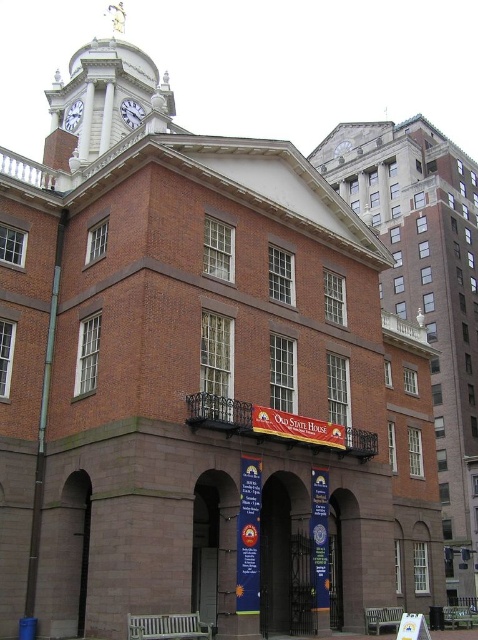
You are a tourist standing in front of the Old State House and want to take a photo that includes both the white marble clock tower at upper left and the silver metallic clock at upper center. Based on their positions, which one should you position to the left side in your camera viewfinder?

The white marble clock tower at upper left is positioned on the left side of the silver metallic clock at upper center, so you should place the white marble clock tower at upper left to the left side in your camera viewfinder.

You are standing in front of the Old State House and notice two clocks on the central clock tower. The first is a white glossy clock at upper center and the second is a silver metallic clock at upper center. From your vantage point, which clock appears closer to you?

The white glossy clock at upper center appears closer because it is in front of the silver metallic clock at upper center.

You are standing in front of the Old State House and notice the white metallic clock at upper center. Where exactly is this clock positioned relative to the building?

The white metallic clock at upper center is located at point coordinates 0.177 on the x axis and 0.276 on the y axis relative to the building.